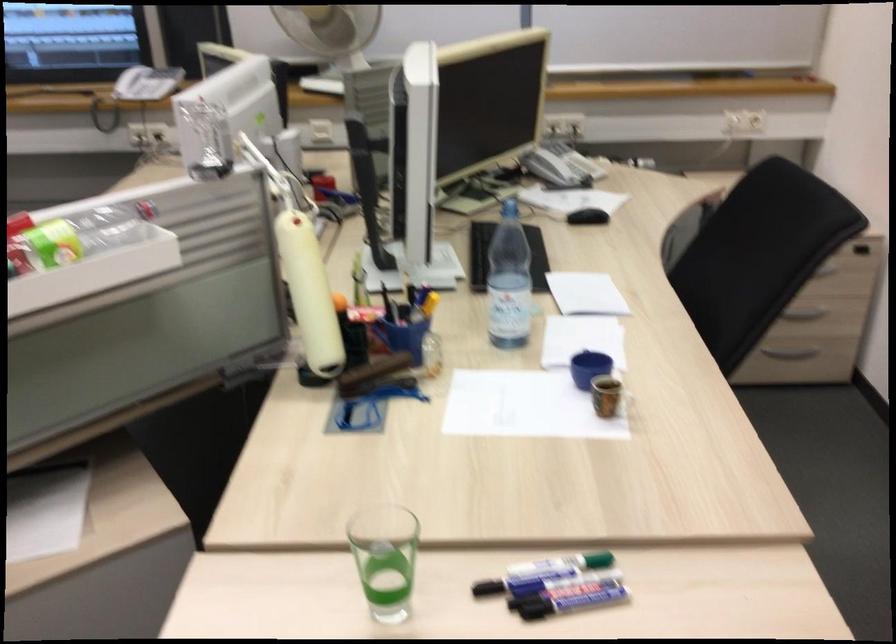
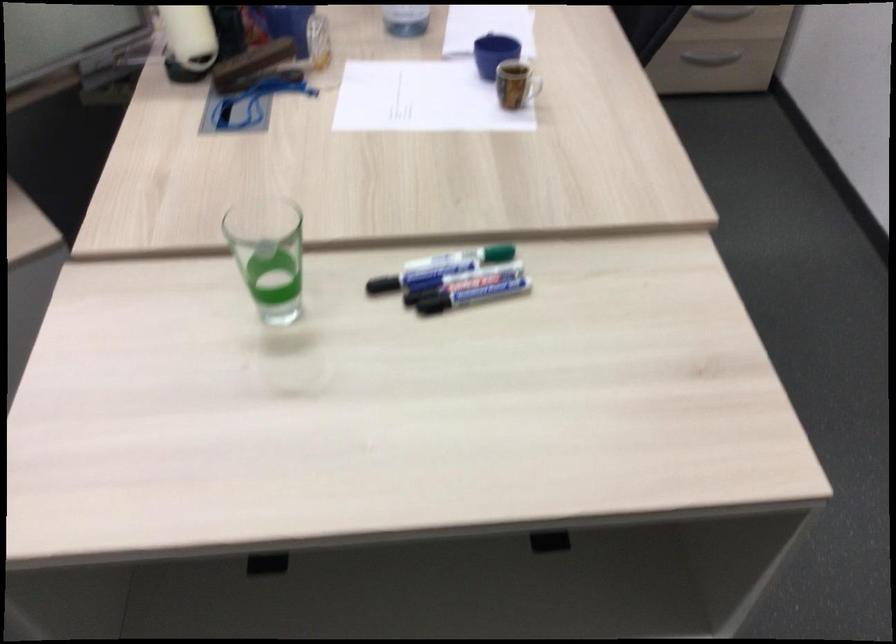
Locate, in the second image, the point that corresponds to [383,562] in the first image.

(268, 254)